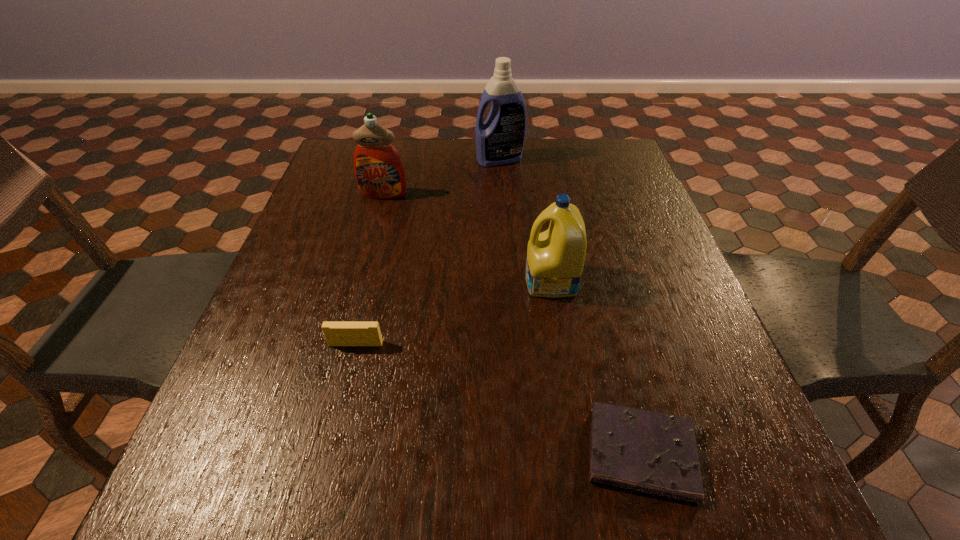
Find the location of a particular element. vacant region located 0.260m on the front surface of the second farthest detergent is located at coordinates (364, 268).

Locate an element on the screen. The height and width of the screenshot is (540, 960). free space located on the label of the nearest detergent is located at coordinates (479, 281).

Find the location of a particular element. vacant space positioned 0.350m on the label of the nearest detergent is located at coordinates (364, 281).

Identify the location of free space located on the label of the nearest detergent. (410, 281).

Identify the location of free space located 0.130m at the front of the second shortest object with spools. The width and height of the screenshot is (960, 540). (340, 411).

Where is `free spot located on the left of the shortest object`? The image size is (960, 540). free spot located on the left of the shortest object is located at coordinates (546, 454).

Where is `object positioned at the far edge`? The height and width of the screenshot is (540, 960). object positioned at the far edge is located at coordinates (500, 140).

The image size is (960, 540). Identify the location of object present at the near edge. (656, 453).

Identify the location of detergent that is at the left edge. The height and width of the screenshot is (540, 960). (379, 171).

Identify the location of videotape situated at the left edge. (336, 333).